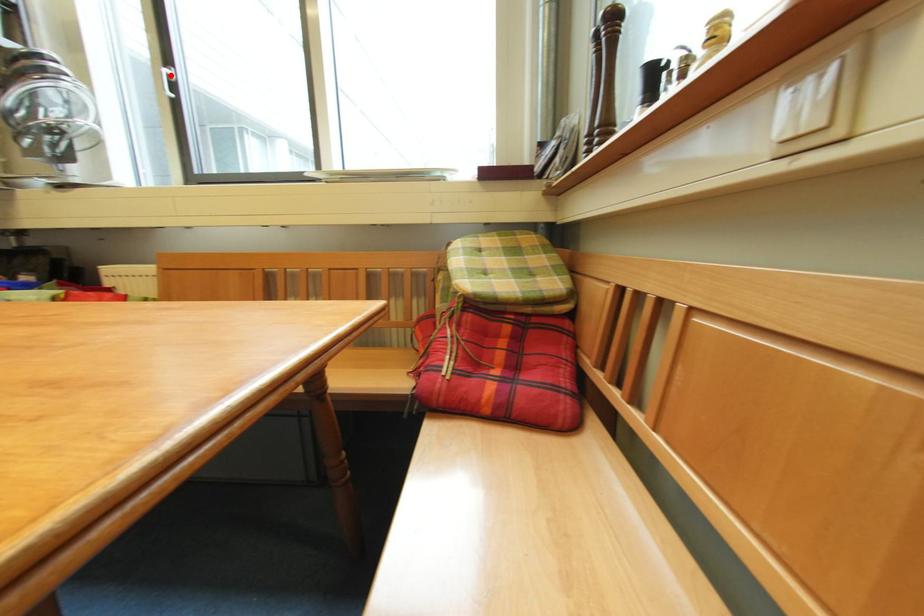
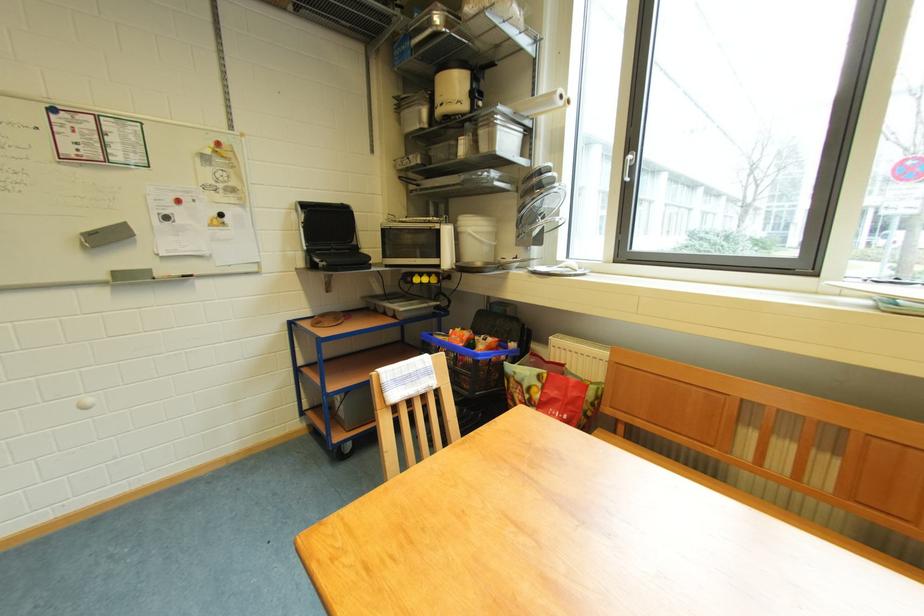
The point at the highlighted location is marked in the first image. Where is the corresponding point in the second image?

(634, 161)